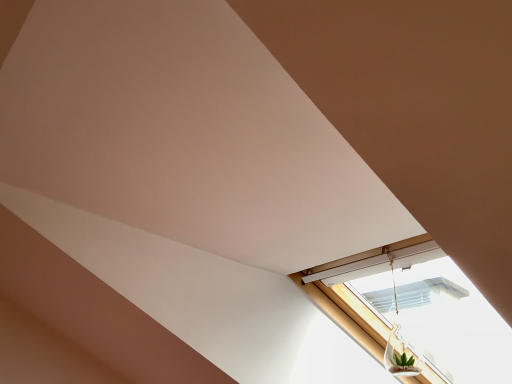
This screenshot has width=512, height=384. What do you see at coordinates (400, 342) in the screenshot?
I see `transparent glass hanging plant at upper right` at bounding box center [400, 342].

Find the location of a particular element. The image size is (512, 384). transparent glass hanging plant at upper right is located at coordinates (400, 342).

At what (x,y) coordinates should I click in order to perform the action: click on transparent glass hanging plant at upper right. Please return your answer as a coordinate pair (x, y). The image size is (512, 384). Looking at the image, I should click on (400, 342).